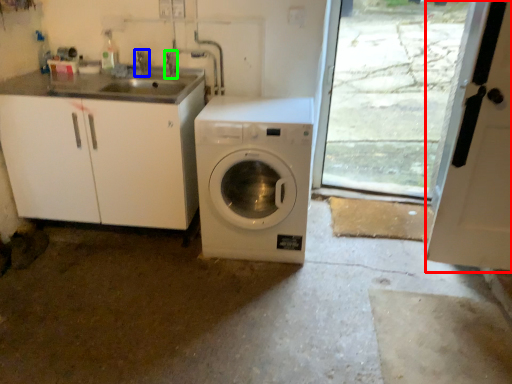
Question: Considering the real-world distances, which object is closest to screen door (highlighted by a red box)? faucet (highlighted by a blue box) or faucet (highlighted by a green box).

Choices:
 (A) faucet
 (B) faucet

Answer: (B)